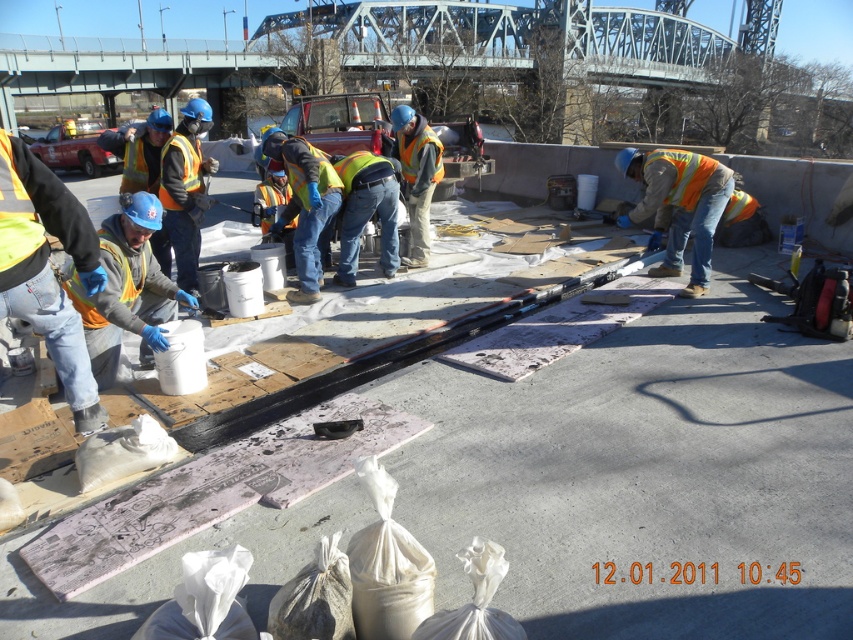
You are a safety inspector on the rooftop and need to retrieve a tool from the matte gray bucket at lower left before checking the safety of the orange reflective vest at center. Which object should you approach first based on their positions?

You should approach the matte gray bucket at lower left first because it is closer to you than the orange reflective vest at center.

You are a construction worker who needs to carry the matte gray bucket at lower left and the orange reflective vest at center to the storage room. Which item requires a wider space to carry due to its size?

The matte gray bucket at lower left requires a wider space to carry because its width is larger than the orange reflective vest at center.